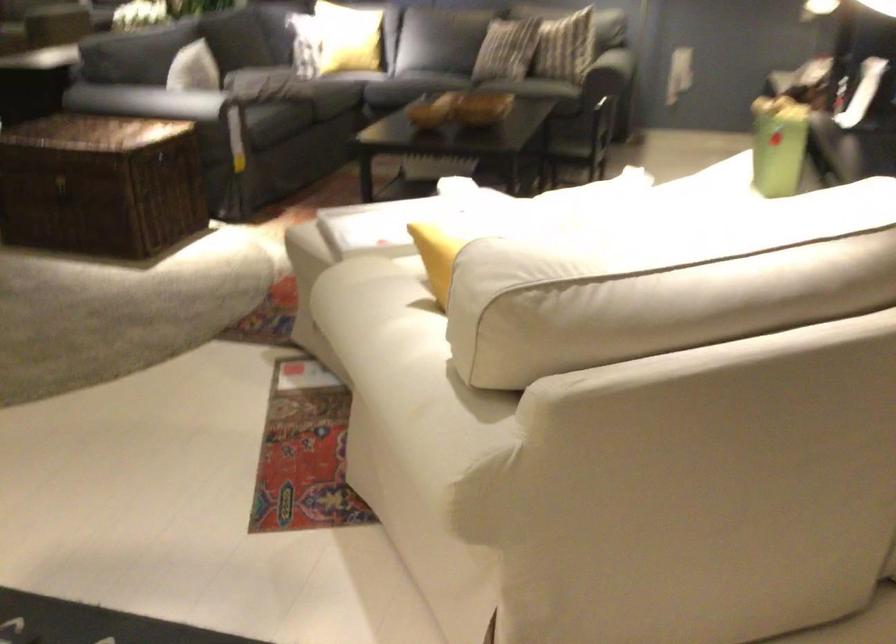
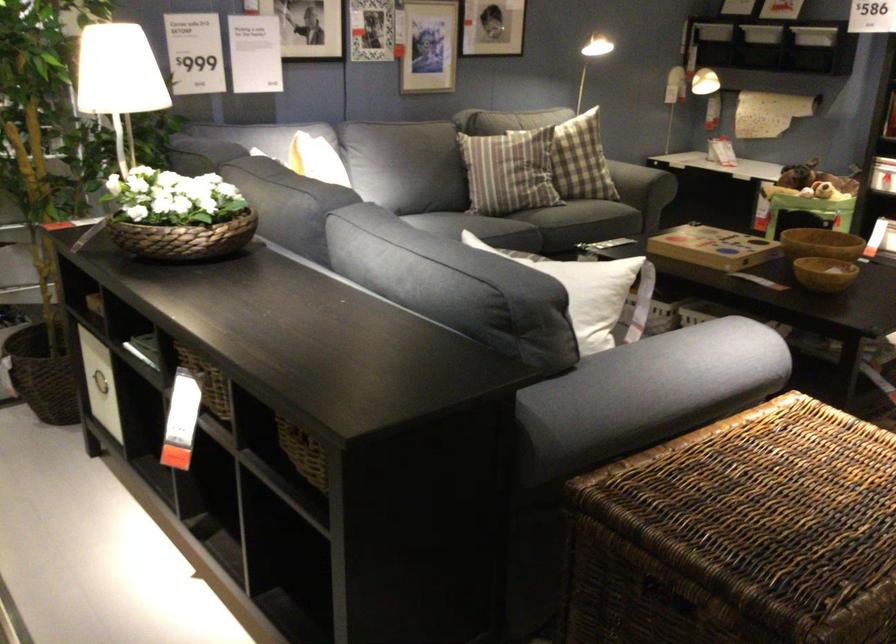
In the second image, find the point that corresponds to point 460,96 in the first image.

(821, 243)